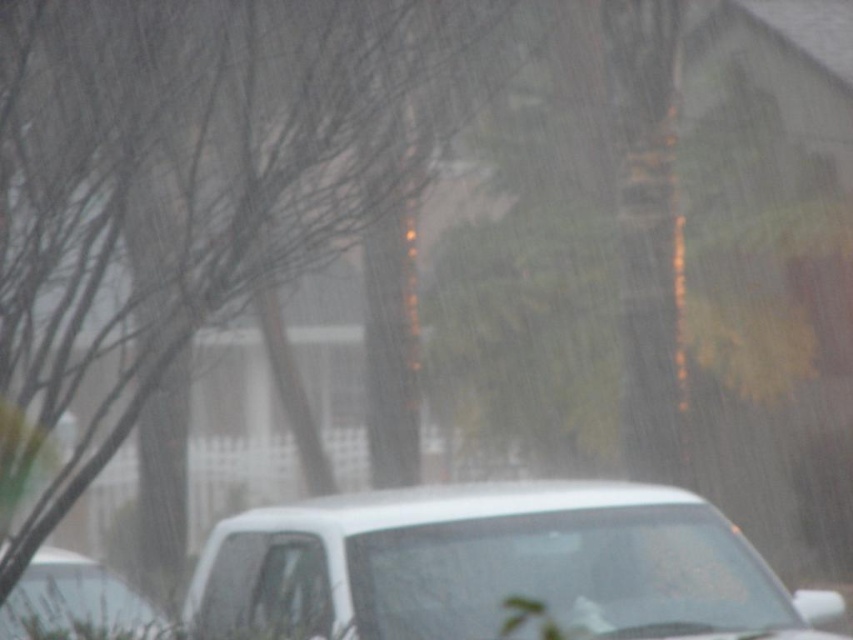
Question: Is white matte car at lower center positioned in front of white matte car at lower left?

Choices:
 (A) no
 (B) yes

Answer: (B)

Question: Is white matte car at lower center below white matte car at lower left?

Choices:
 (A) yes
 (B) no

Answer: (A)

Question: Which point is closer to the camera?

Choices:
 (A) (318, 515)
 (B) (62, 632)

Answer: (B)

Question: Is white matte car at lower center thinner than white matte car at lower left?

Choices:
 (A) yes
 (B) no

Answer: (B)